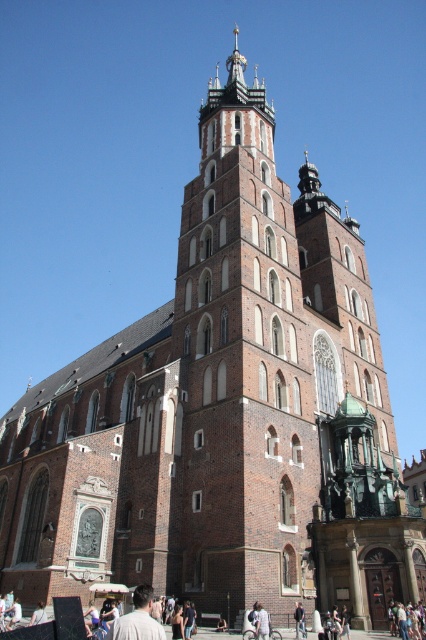
From the picture: Who is lower down, light beige shirt at lower center or light brown leather jacket at center?

Positioned lower is light brown leather jacket at center.

Looking at this image, who is more distant from viewer, (147, 584) or (298, 616)?

Point (147, 584)

Identify the location of light beige shirt at lower center. (138, 620).

What do you see at coordinates (299, 620) in the screenshot? The image size is (426, 640). I see `light brown leather jacket at center` at bounding box center [299, 620].

Is point (296, 614) less distant than point (40, 620)?

No, it is not.

At what (x,y) coordinates should I click in order to perform the action: click on light brown leather jacket at center. Please return your answer as a coordinate pair (x, y). The height and width of the screenshot is (640, 426). Looking at the image, I should click on (299, 620).

Who is positioned more to the right, light beige shirt at lower center or light brown leather jacket at lower left?

light beige shirt at lower center

Is point (141, 634) positioned before point (34, 618)?

Yes, it is.

Image resolution: width=426 pixels, height=640 pixels. I want to click on light beige shirt at lower center, so click(138, 620).